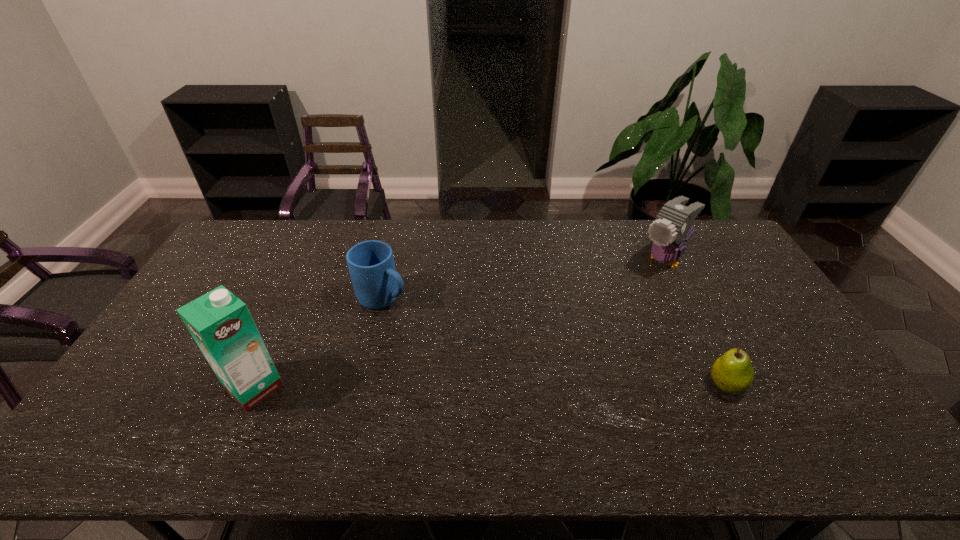
At what (x,y) coordinates should I click in order to perform the action: click on free space located 0.210m on the side of the second shortest object with the handle. Please return your answer as a coordinate pair (x, y). The height and width of the screenshot is (540, 960). Looking at the image, I should click on (457, 338).

Find the location of a particular element. This screenshot has height=540, width=960. free space located 0.180m on the side of the second shortest object with the handle is located at coordinates (448, 333).

At what (x,y) coordinates should I click in order to perform the action: click on free location located 0.310m at the beak of the second tallest object. Please return your answer as a coordinate pair (x, y). The width and height of the screenshot is (960, 540). Looking at the image, I should click on (594, 322).

Identify the location of vacant space located 0.130m at the beak of the second tallest object. (627, 293).

At what (x,y) coordinates should I click in order to perform the action: click on free spot located 0.250m at the beak of the second tallest object. Please return your answer as a coordinate pair (x, y). Looking at the image, I should click on (606, 312).

Find the location of `object located in the far edge section of the desktop`. object located in the far edge section of the desktop is located at coordinates (673, 227).

The image size is (960, 540). In order to click on carton situated at the near edge in this screenshot , I will do `click(220, 323)`.

Where is `pear present at the near edge`? The width and height of the screenshot is (960, 540). pear present at the near edge is located at coordinates (732, 372).

In order to click on free space at the far edge in this screenshot , I will do `click(637, 223)`.

The image size is (960, 540). I want to click on free space at the near edge of the desktop, so click(466, 413).